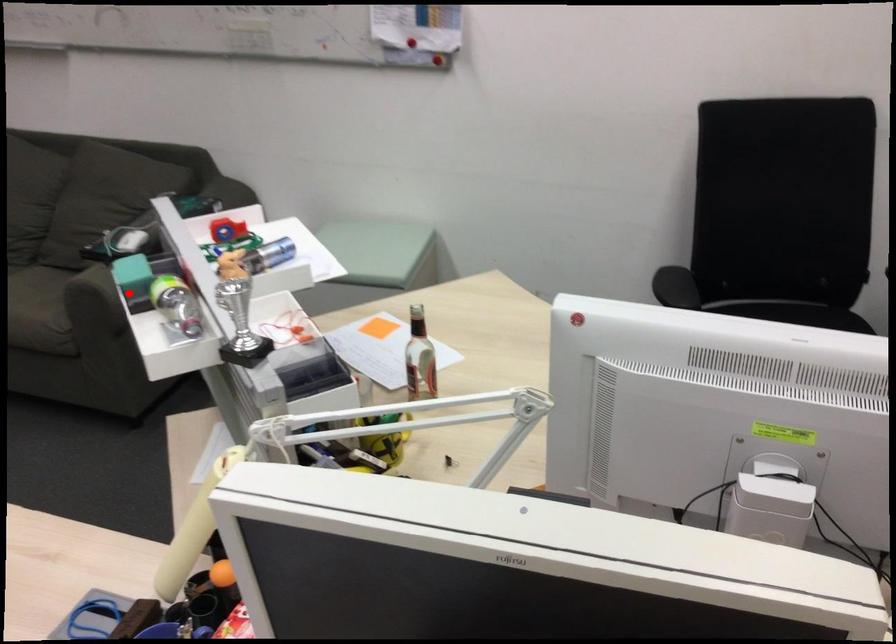
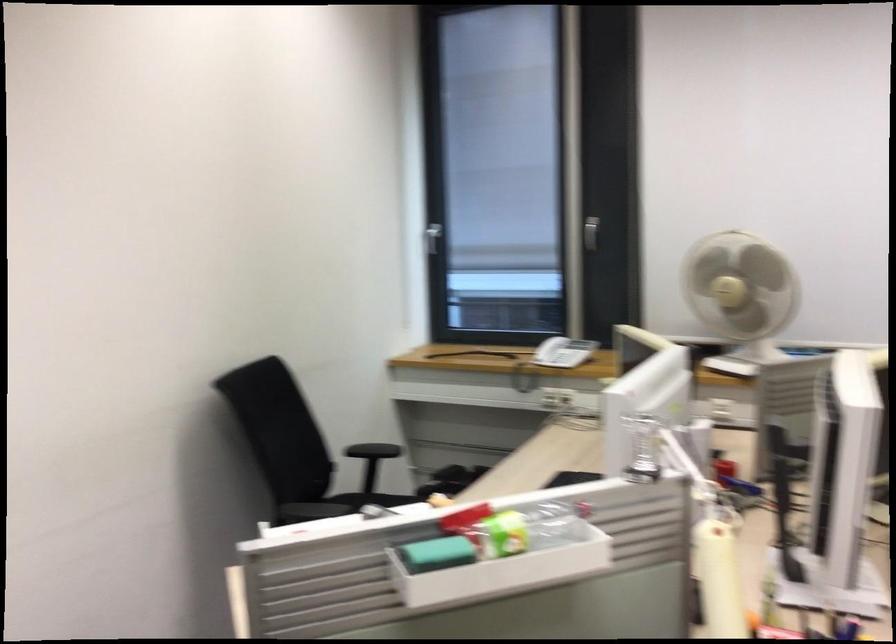
In the second image, find the point that corresponds to the highlighted location in the first image.

(436, 554)